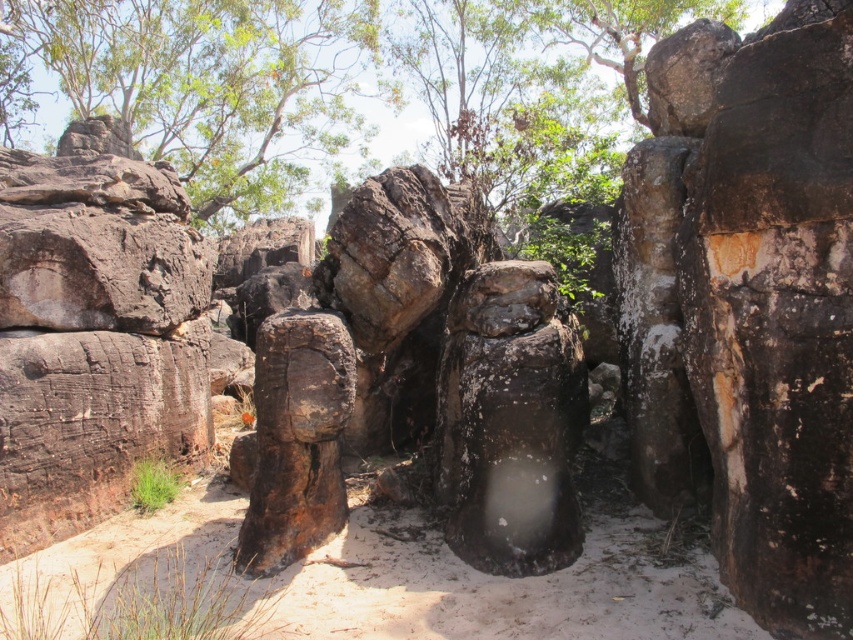
Between white sandy ground at center and green leafy tree at upper left, which one appears on the left side from the viewer's perspective?

Positioned to the left is green leafy tree at upper left.

Consider the image. Can you confirm if white sandy ground at center is bigger than green leafy tree at upper left?

Incorrect, white sandy ground at center is not larger than green leafy tree at upper left.

This screenshot has width=853, height=640. I want to click on white sandy ground at center, so click(x=354, y=584).